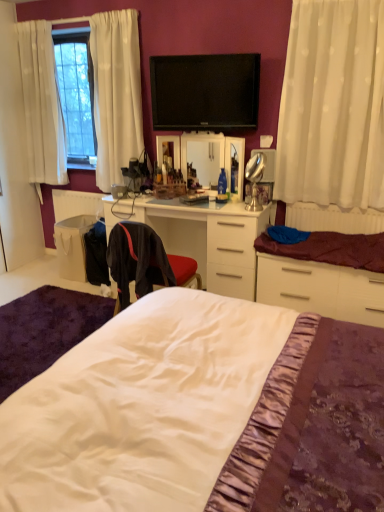
You are a GUI agent. You are given a task and a screenshot of the screen. Output one action in this format:
    pyautogui.click(x=<x>, y=<y>)
    Task: Click on the vacant point above white plastic radiator at right (from a real-world perspective)
    The height and width of the screenshot is (512, 384).
    Given the screenshot: What is the action you would take?
    pyautogui.click(x=324, y=204)